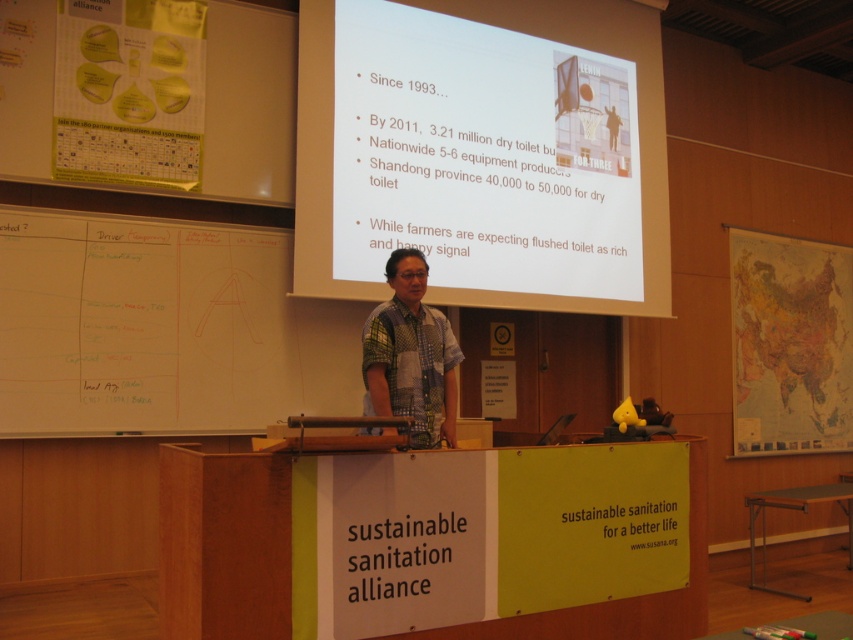
Based on the scene description, where is the white matte projector screen at upper center located in the image?

The white matte projector screen at upper center is located at point [485,150].

You are an attendee at this presentation and want to take a photo of the slide on the white matte projector screen at upper center. However, the printed cotton shirt at center is blocking your view. Can you determine if the screen is taller than the shirt?

The white matte projector screen at upper center is taller than the printed cotton shirt at center, so the screen extends above the shirt, allowing you to take a photo of the slide without obstruction from the shirt.

Looking at this image, you are a photographer setting up for a presentation. You need to position yourself so that the wooden podium at center is in focus while capturing the speaker and the projection screen. Given that the camera has a depth of field range of 2 meters, will the podium remain in focus if you focus on the speaker who is standing 2.2 meters away from the camera?

The wooden podium at center is 2.44 meters from the camera. If the speaker is 2.2 meters away, focusing on the speaker would place the podium at 0.24 meters beyond the focus point. Since the depth of field range is 2 meters, the podium would still be within the acceptable focus range and remain sharp in the photo.